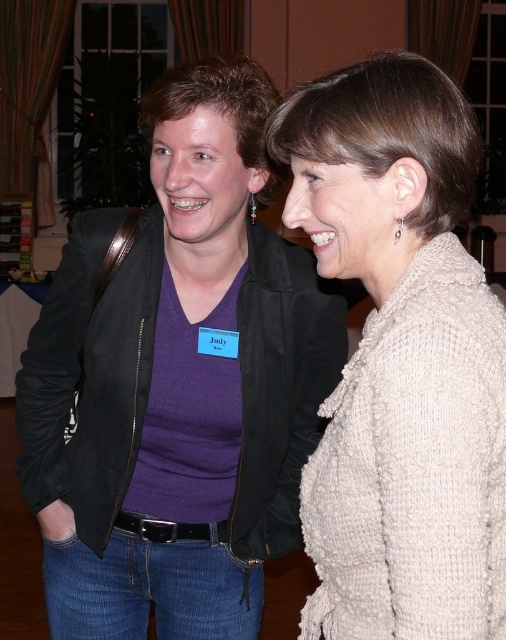
Question: Which point is closer to the camera taking this photo?

Choices:
 (A) tap(312, 320)
 (B) tap(346, 433)

Answer: (B)

Question: Is knitted beige sweater at right thinner than knitted beige sweater at center?

Choices:
 (A) no
 (B) yes

Answer: (B)

Question: Does knitted beige sweater at right have a smaller size compared to knitted beige sweater at center?

Choices:
 (A) yes
 (B) no

Answer: (A)

Question: Does knitted beige sweater at right appear on the right side of knitted beige sweater at center?

Choices:
 (A) no
 (B) yes

Answer: (B)